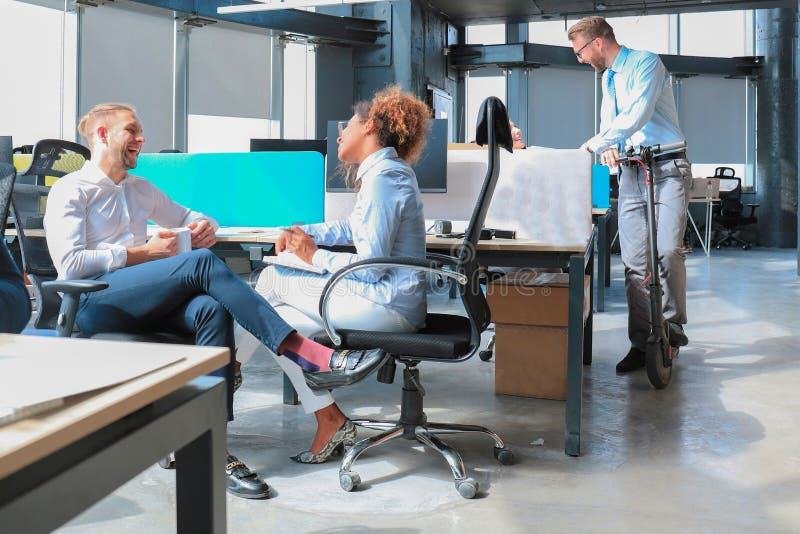
Find the location of a particular element. The image size is (800, 534). overhead light structures is located at coordinates (498, 47), (538, 53), (701, 62), (338, 21), (262, 15).